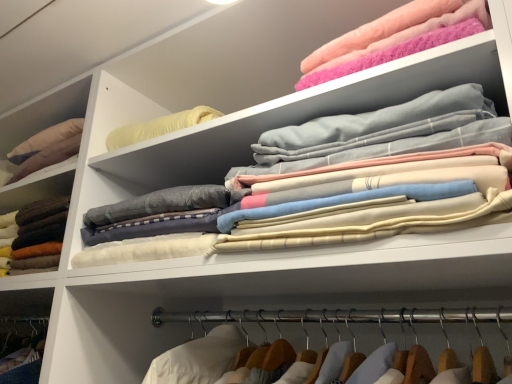
Question: Which direction should I rotate to look at soft cotton sheets at upper center, the 2th clothing when ordered from left to right, — up or down?

Choices:
 (A) down
 (B) up

Answer: (B)

Question: Can you confirm if soft wool sweater at left, placed as the 1th clothing when sorted from left to right, is wider than fluffy pink towel at upper right, arranged as the 1th clothing when viewed from the right?

Choices:
 (A) no
 (B) yes

Answer: (B)

Question: From the image's perspective, does soft wool sweater at left, which is the 3th clothing from right to left, appear lower than fluffy pink towel at upper right, arranged as the 1th clothing when viewed from the right?

Choices:
 (A) yes
 (B) no

Answer: (A)

Question: Can you confirm if soft wool sweater at left, which is the 3th clothing from right to left, is positioned to the right of fluffy pink towel at upper right, marked as the third clothing in a left-to-right arrangement?

Choices:
 (A) no
 (B) yes

Answer: (A)

Question: Considering the relative sizes of soft wool sweater at left, which is the 3th clothing from right to left, and fluffy pink towel at upper right, arranged as the 1th clothing when viewed from the right, in the image provided, is soft wool sweater at left, which is the 3th clothing from right to left, thinner than fluffy pink towel at upper right, arranged as the 1th clothing when viewed from the right,?

Choices:
 (A) no
 (B) yes

Answer: (A)

Question: Is fluffy pink towel at upper right, marked as the third clothing in a left-to-right arrangement, at the back of soft wool sweater at left, placed as the 1th clothing when sorted from left to right?

Choices:
 (A) yes
 (B) no

Answer: (B)

Question: From the image's perspective, is soft wool sweater at left, placed as the 1th clothing when sorted from left to right, located above fluffy pink towel at upper right, arranged as the 1th clothing when viewed from the right?

Choices:
 (A) no
 (B) yes

Answer: (A)

Question: Is fluffy pink towel at upper right, arranged as the 1th clothing when viewed from the right, next to soft wool sweater at left, placed as the 1th clothing when sorted from left to right?

Choices:
 (A) yes
 (B) no

Answer: (B)

Question: From the image's perspective, is fluffy pink towel at upper right, marked as the third clothing in a left-to-right arrangement, above soft wool sweater at left, which is the 3th clothing from right to left?

Choices:
 (A) yes
 (B) no

Answer: (A)

Question: Considering the relative positions of fluffy pink towel at upper right, arranged as the 1th clothing when viewed from the right, and soft wool sweater at left, which is the 3th clothing from right to left, in the image provided, is fluffy pink towel at upper right, arranged as the 1th clothing when viewed from the right, in front of soft wool sweater at left, which is the 3th clothing from right to left,?

Choices:
 (A) no
 (B) yes

Answer: (B)

Question: Considering the relative sizes of fluffy pink towel at upper right, marked as the third clothing in a left-to-right arrangement, and soft wool sweater at left, which is the 3th clothing from right to left, in the image provided, is fluffy pink towel at upper right, marked as the third clothing in a left-to-right arrangement, shorter than soft wool sweater at left, which is the 3th clothing from right to left,?

Choices:
 (A) no
 (B) yes

Answer: (B)

Question: From a real-world perspective, is fluffy pink towel at upper right, marked as the third clothing in a left-to-right arrangement, positioned over soft wool sweater at left, which is the 3th clothing from right to left, based on gravity?

Choices:
 (A) no
 (B) yes

Answer: (B)

Question: Considering the relative sizes of fluffy pink towel at upper right, marked as the third clothing in a left-to-right arrangement, and soft wool sweater at left, which is the 3th clothing from right to left, in the image provided, is fluffy pink towel at upper right, marked as the third clothing in a left-to-right arrangement, taller than soft wool sweater at left, which is the 3th clothing from right to left,?

Choices:
 (A) yes
 (B) no

Answer: (B)

Question: Considering the relative sizes of soft wool sweater at left, placed as the 1th clothing when sorted from left to right, and soft cotton sheets at upper center, marked as the 2th clothing in a right-to-left arrangement, in the image provided, is soft wool sweater at left, placed as the 1th clothing when sorted from left to right, taller than soft cotton sheets at upper center, marked as the 2th clothing in a right-to-left arrangement,?

Choices:
 (A) yes
 (B) no

Answer: (B)